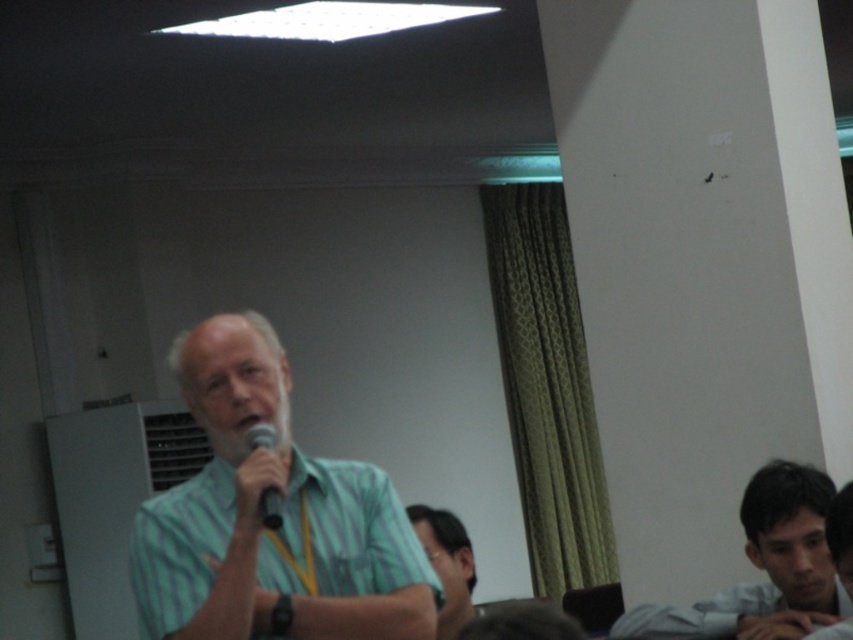
Where is the green striped shirt at center located in the image?

The green striped shirt at center is located at point 0.816 on the x axis and 0.306 on the y axis.

You are an event organizer who needs to determine the seating arrangement based on the speaker and audience positions. Since the green striped shirt at center is taller than the matte green shirt at lower center, which one is more likely to be the speaker?

The green striped shirt at center is more likely to be the speaker because it has a greater height compared to the matte green shirt at lower center, and speakers are typically positioned centrally and are more prominent in such settings.